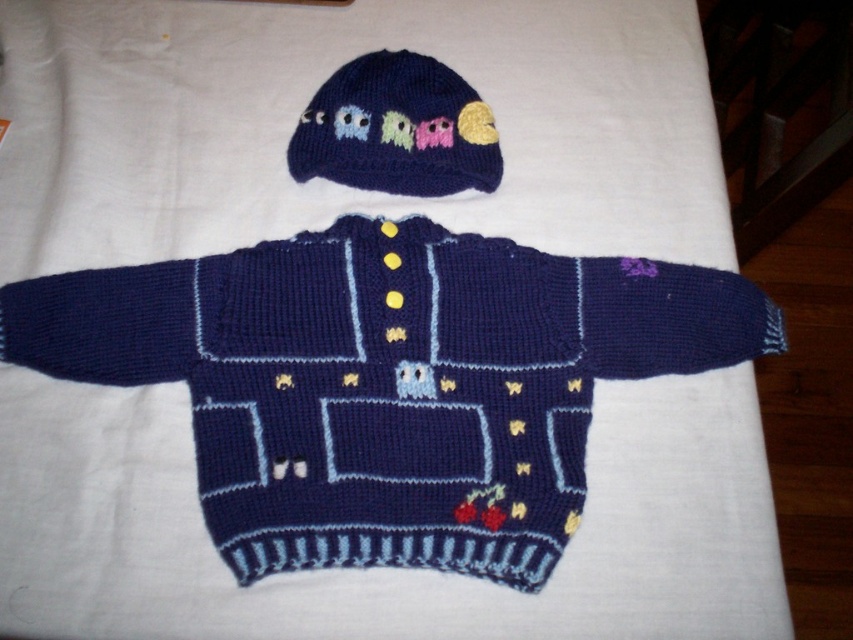
Does navy blue knitted sweater at center have a greater width compared to knitted dark blue hat at upper center?

Indeed, navy blue knitted sweater at center has a greater width compared to knitted dark blue hat at upper center.

What do you see at coordinates (387, 381) in the screenshot? I see `navy blue knitted sweater at center` at bounding box center [387, 381].

The height and width of the screenshot is (640, 853). I want to click on navy blue knitted sweater at center, so click(x=387, y=381).